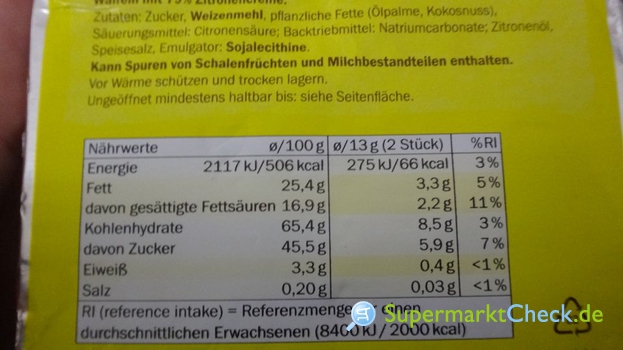
Where is `cells of table`? cells of table is located at coordinates (220, 143), (235, 255), (405, 139), (379, 212), (486, 140), (478, 222), (290, 309).